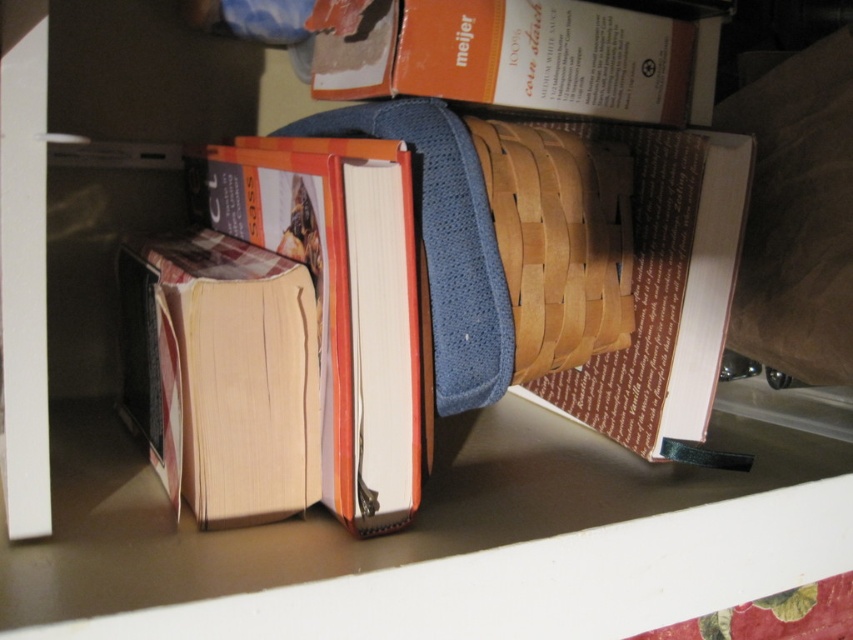
Consider the image. Which is below, brown paper at center or natural wood basket at center?

Positioned lower is brown paper at center.

Between point (740, 467) and point (616, 212), which one is positioned behind?

Point (616, 212)

Looking at this image, who is more distant from viewer, (596, 365) or (540, 285)?

The point (596, 365) is more distant.

At what (x,y) coordinates should I click in order to perform the action: click on brown paper at center. Please return your answer as a coordinate pair (x, y). This screenshot has height=640, width=853. Looking at the image, I should click on (665, 291).

Can you confirm if orange cardboard box at upper center is positioned to the left of brown paper at center?

Correct, you'll find orange cardboard box at upper center to the left of brown paper at center.

In the scene shown: Which of these two, orange cardboard box at upper center or brown paper at center, stands taller?

brown paper at center is taller.

Is point (668, 77) closer to camera compared to point (677, 131)?

Yes, it is in front of point (677, 131).

Locate an element on the screen. orange cardboard box at upper center is located at coordinates (526, 58).

Does orange cardboard box at upper center lie in front of natural wood basket at center?

No, it is behind natural wood basket at center.

Who is positioned more to the left, orange cardboard box at upper center or natural wood basket at center?

orange cardboard box at upper center

Find the location of a particular element. The width and height of the screenshot is (853, 640). orange cardboard box at upper center is located at coordinates 526,58.